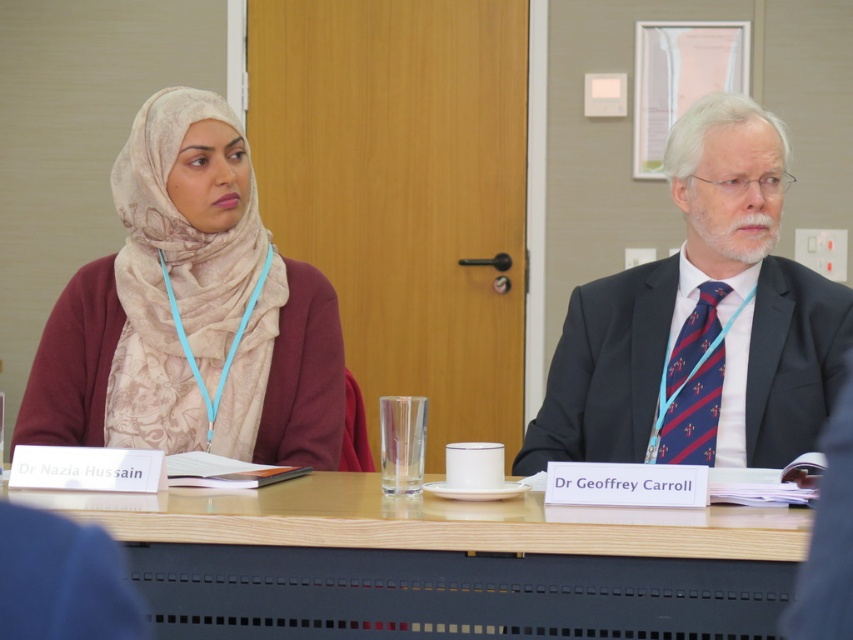
The height and width of the screenshot is (640, 853). I want to click on dark blue suit at right, so click(701, 321).

Can you confirm if dark blue suit at right is taller than dark blue striped tie at right?

Correct, dark blue suit at right is much taller as dark blue striped tie at right.

Image resolution: width=853 pixels, height=640 pixels. I want to click on dark blue suit at right, so click(701, 321).

Who is higher up, wooden table at center or beige floral hijab at center?

Positioned higher is beige floral hijab at center.

Who is lower down, wooden table at center or beige floral hijab at center?

wooden table at center is lower down.

Find the location of `wooden table at center`. wooden table at center is located at coordinates (442, 563).

Is beige floral hijab at center to the left of dark blue striped tie at right from the viewer's perspective?

→ Correct, you'll find beige floral hijab at center to the left of dark blue striped tie at right.

Looking at this image, does beige floral hijab at center have a greater height compared to dark blue striped tie at right?

Correct, beige floral hijab at center is much taller as dark blue striped tie at right.

Between point (120, 308) and point (670, 428), which one is positioned in front?

Point (670, 428)

This screenshot has height=640, width=853. Find the location of `beige floral hijab at center`. beige floral hijab at center is located at coordinates (190, 312).